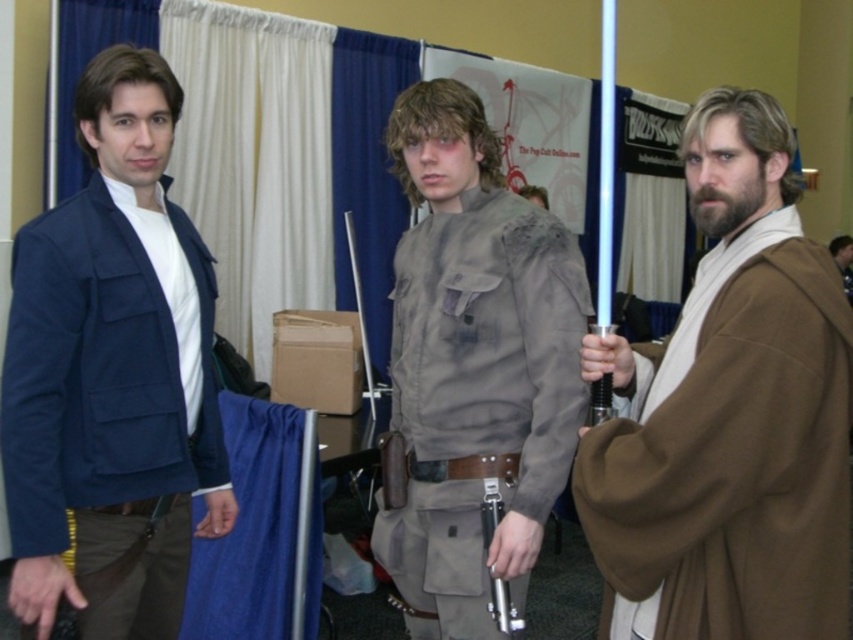
Question: Considering the real-world distances, which object is closest to the gray fabric shirt at center?

Choices:
 (A) metallic silver lightsaber at center
 (B) brown suede jacket at center

Answer: (A)

Question: Which of the following is the closest to the observer?

Choices:
 (A) metallic silver lightsaber at center
 (B) gray fabric shirt at center
 (C) matte blue jacket at left
 (D) brown cloth robe at right

Answer: (D)

Question: Is brown cloth robe at right above brown suede jacket at center?

Choices:
 (A) no
 (B) yes

Answer: (A)

Question: Which object is positioned farthest from the gray fabric shirt at center?

Choices:
 (A) brown cloth robe at right
 (B) brown suede jacket at center
 (C) matte blue jacket at left
 (D) metallic silver lightsaber at center

Answer: (B)

Question: Is gray fabric shirt at center further to camera compared to metallic silver lightsaber at center?

Choices:
 (A) no
 (B) yes

Answer: (B)

Question: Can you confirm if gray fabric shirt at center is thinner than brown suede jacket at center?

Choices:
 (A) no
 (B) yes

Answer: (B)